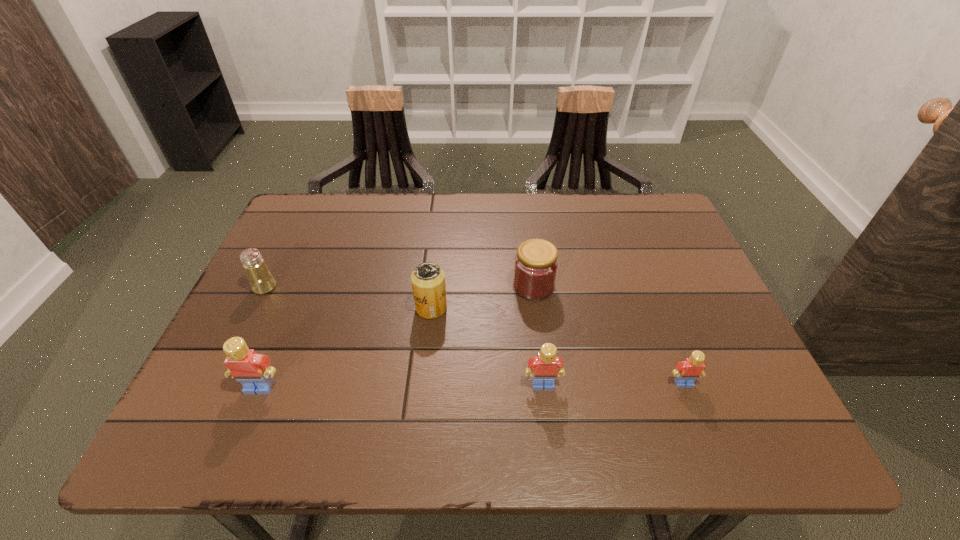
If equal spacing is the goal by inserting an additional Lego among them, please point out a vacant space for this new Lego. Please provide its 2D coordinates. Your answer should be formatted as a tuple, i.e. [(x, y)], where the tuple contains the x and y coordinates of a point satisfying the conditions above.

[(401, 386)]